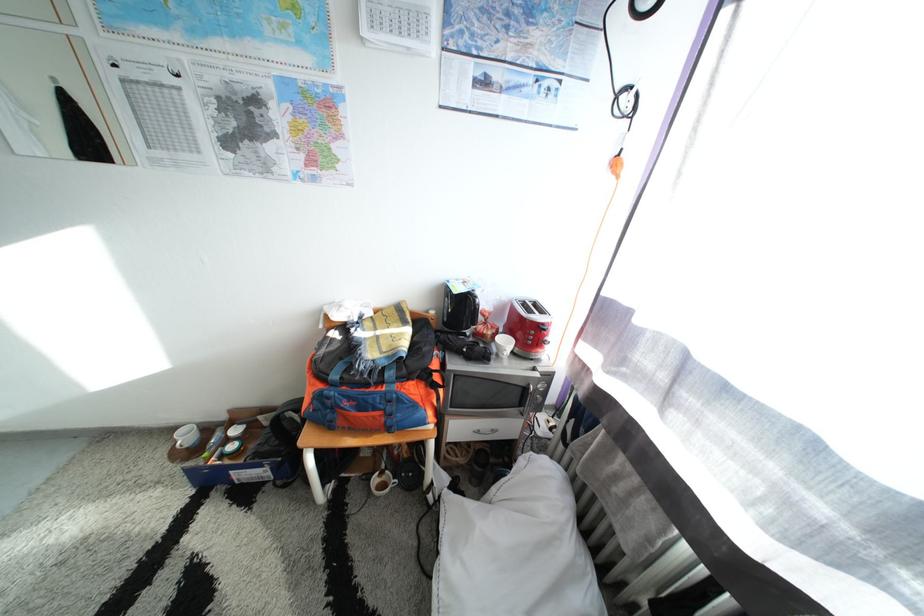
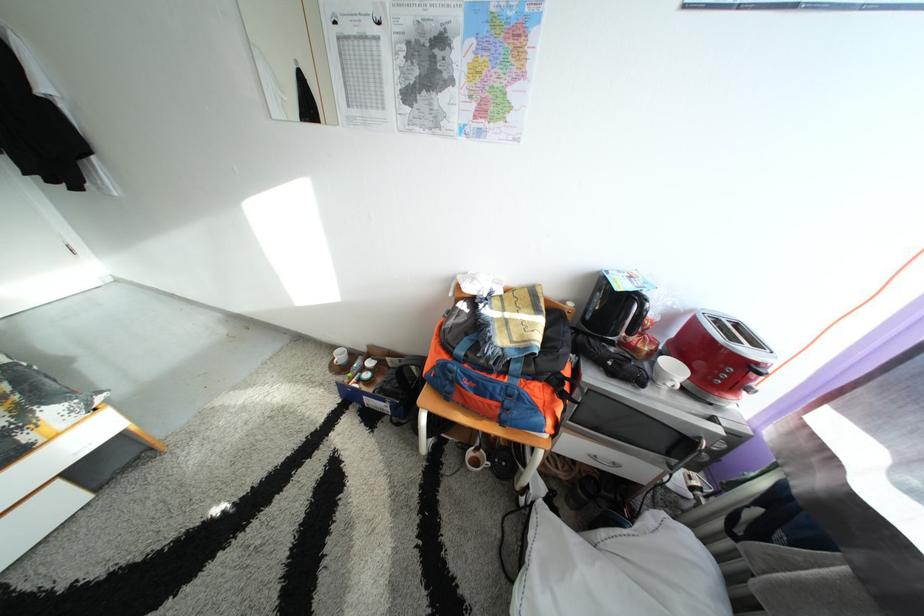
Locate, in the second image, the point that corresponds to the point at 393,485 in the first image.

(487, 461)